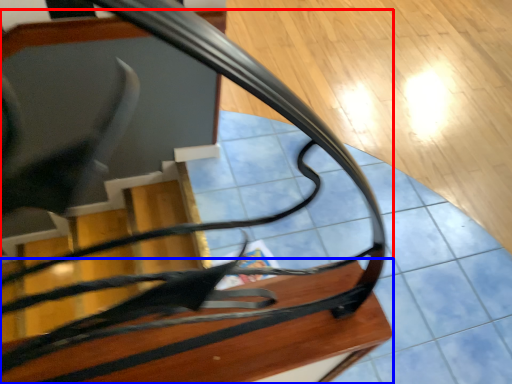
Question: Which of the following is the closest to the observer, furniture (highlighted by a red box) or table (highlighted by a blue box)?

Choices:
 (A) furniture
 (B) table

Answer: (B)